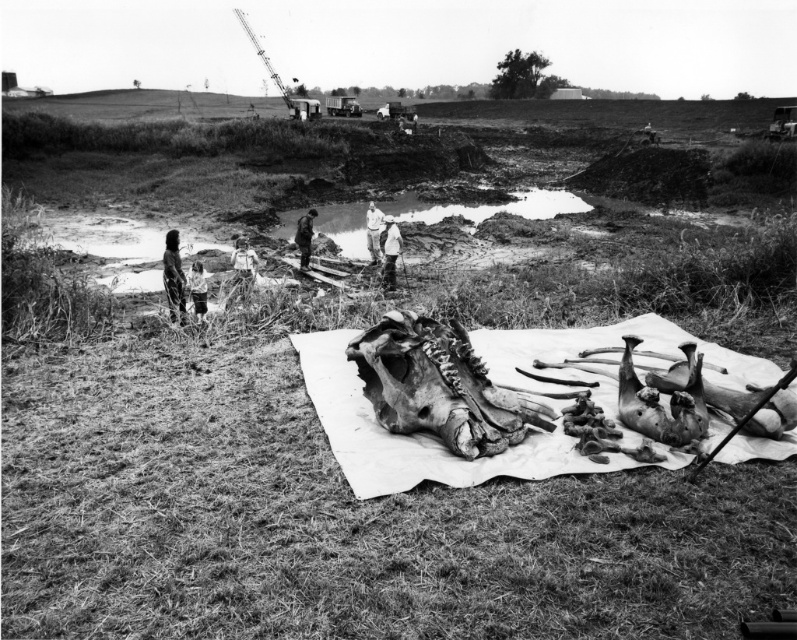
Question: Which point is closer to the camera?

Choices:
 (A) smooth skin human at center
 (B) smooth skin child at center

Answer: (A)

Question: Can you confirm if white cloth at center is positioned to the left of metallic gray crane at upper center?

Choices:
 (A) no
 (B) yes

Answer: (A)

Question: Is the position of white cloth at center more distant than that of smooth skin human at center?

Choices:
 (A) yes
 (B) no

Answer: (B)

Question: Does white cotton shirt at center come behind smooth skin child at center?

Choices:
 (A) yes
 (B) no

Answer: (A)

Question: Estimate the real-world distances between objects in this image. Which object is closer to the smooth skin human at center?

Choices:
 (A) white cotton shirt at center
 (B) light brown leather jacket at lower left
 (C) rusty metallic skull at center
 (D) smooth skin child at center

Answer: (B)

Question: Estimate the real-world distances between objects in this image. Which object is farther from the dark gray fabric jacket at center?

Choices:
 (A) smooth skin child at center
 (B) rusty metallic skull at center
 (C) smooth skin human at center

Answer: (B)